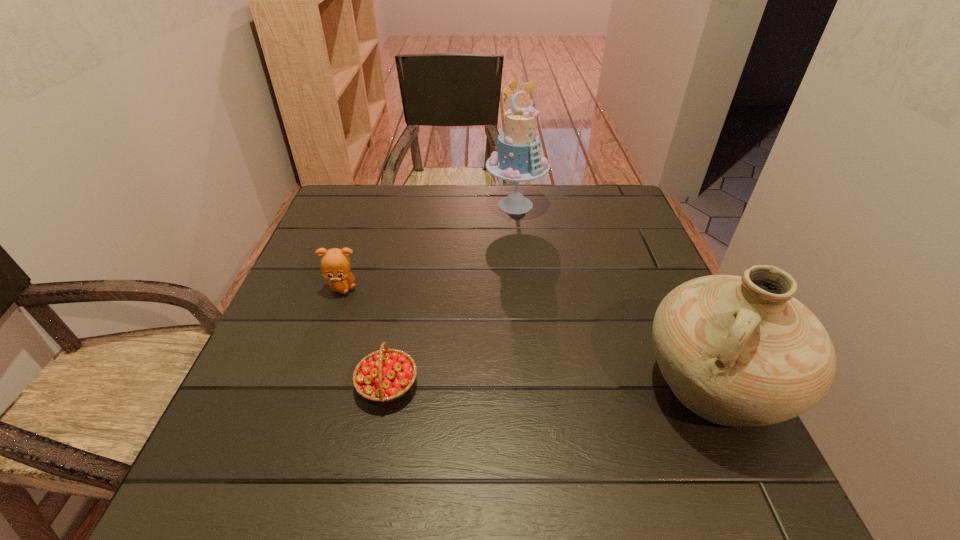
Locate an element on the screen. The image size is (960, 540). object present at the right edge is located at coordinates (736, 350).

At what (x,y) coordinates should I click in order to perform the action: click on object located in the near right corner section of the desktop. Please return your answer as a coordinate pair (x, y). This screenshot has height=540, width=960. Looking at the image, I should click on (736, 350).

Image resolution: width=960 pixels, height=540 pixels. I want to click on free space at the far edge of the desktop, so click(488, 193).

The height and width of the screenshot is (540, 960). In order to click on vacant space at the near edge of the desktop in this screenshot , I will do (x=604, y=434).

In the image, there is a desktop. Where is `blank space at the left edge`? The height and width of the screenshot is (540, 960). blank space at the left edge is located at coordinates (331, 309).

At what (x,y) coordinates should I click in order to perform the action: click on free space at the right edge of the desktop. Please return your answer as a coordinate pair (x, y). Image resolution: width=960 pixels, height=540 pixels. Looking at the image, I should click on (615, 289).

At what (x,y) coordinates should I click in order to perform the action: click on vacant region at the far left corner of the desktop. Please return your answer as a coordinate pair (x, y). The width and height of the screenshot is (960, 540). Looking at the image, I should click on (338, 227).

In the image, there is a desktop. Where is `free space at the far right corner`? Image resolution: width=960 pixels, height=540 pixels. free space at the far right corner is located at coordinates (610, 193).

This screenshot has height=540, width=960. In order to click on unoccupied area between the second farthest object and the shortest object in this screenshot , I will do `click(366, 336)`.

Locate an element on the screen. This screenshot has height=540, width=960. empty space that is in between the strawberry and the third tallest object is located at coordinates (366, 336).